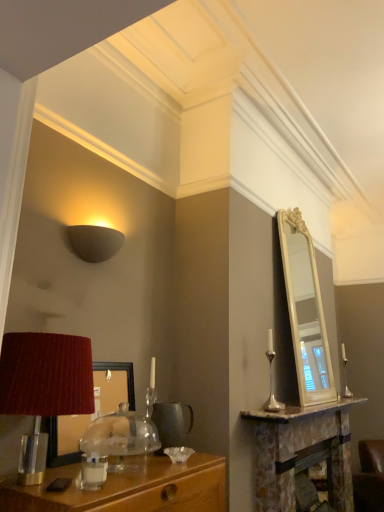
Question: Does matte black mirror at left have a greater height compared to matte gray wall sconce at upper left?

Choices:
 (A) yes
 (B) no

Answer: (A)

Question: Is the position of matte black mirror at left more distant than that of matte gray wall sconce at upper left?

Choices:
 (A) yes
 (B) no

Answer: (B)

Question: Is matte black mirror at left closer to camera compared to matte gray wall sconce at upper left?

Choices:
 (A) no
 (B) yes

Answer: (B)

Question: From a real-world perspective, is matte black mirror at left under matte gray wall sconce at upper left?

Choices:
 (A) no
 (B) yes

Answer: (B)

Question: Could you tell me if matte black mirror at left is facing matte gray wall sconce at upper left?

Choices:
 (A) yes
 (B) no

Answer: (B)

Question: Would you say matte black mirror at left is to the left or to the right of brown leather swivel chair at lower right in the picture?

Choices:
 (A) left
 (B) right

Answer: (A)

Question: From a real-world perspective, is matte black mirror at left positioned above or below brown leather swivel chair at lower right?

Choices:
 (A) below
 (B) above

Answer: (B)

Question: Does point (105, 373) appear closer or farther from the camera than point (382, 490)?

Choices:
 (A) closer
 (B) farther

Answer: (A)

Question: From the image's perspective, relative to brown leather swivel chair at lower right, is matte black mirror at left above or below?

Choices:
 (A) below
 (B) above

Answer: (B)

Question: From the image's perspective, relative to brown leather swivel chair at lower right, is matte gray wall sconce at upper left above or below?

Choices:
 (A) below
 (B) above

Answer: (B)

Question: Is matte gray wall sconce at upper left inside the boundaries of brown leather swivel chair at lower right, or outside?

Choices:
 (A) inside
 (B) outside

Answer: (B)

Question: Is point (102, 259) positioned closer to the camera than point (365, 504)?

Choices:
 (A) closer
 (B) farther

Answer: (A)

Question: Looking at their shapes, would you say matte gray wall sconce at upper left is wider or thinner than brown leather swivel chair at lower right?

Choices:
 (A) thin
 (B) wide

Answer: (A)

Question: Looking at their shapes, would you say matte red lampshade at left is wider or thinner than brown leather swivel chair at lower right?

Choices:
 (A) thin
 (B) wide

Answer: (A)

Question: Considering the relative positions of matte red lampshade at left and brown leather swivel chair at lower right in the image provided, is matte red lampshade at left to the left or to the right of brown leather swivel chair at lower right?

Choices:
 (A) right
 (B) left

Answer: (B)